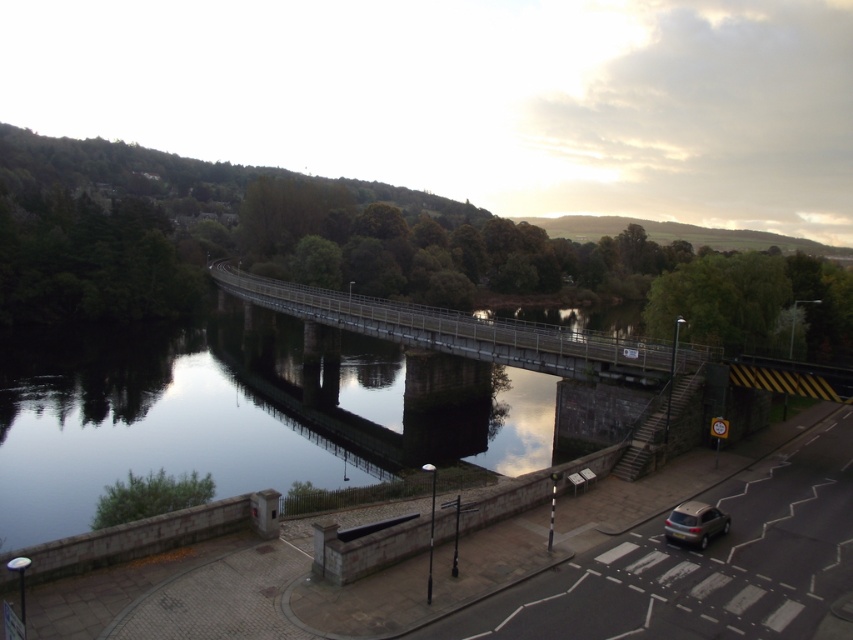
You are a delivery person who needs to park your vehicle near the reflective concrete water at center without blocking the pedestrian crossing. The satin silver car at lower right is already parked there. Can you park your vehicle next to it without overlapping the pedestrian crossing?

The reflective concrete water at center is wider than the satin silver car at lower right. Since the car is already parked there, you can park your vehicle next to it as long as the combined width of both vehicles does not exceed the available space on the road, ensuring that the pedestrian crossing remains unobstructed.

You are standing at the pedestrian crossing on the road and want to cross to the other side to reach the metallic gray bridge at center. According to the coordinates provided, is the bridge directly across from you or to one side?

The metallic gray bridge at center is located at coordinates point (457, 330), which indicates it is positioned centrally in the scene, so it should be directly across from you if you proceed straight across the pedestrian crossing.

You are a pedestrian standing on the sidewalk and want to cross the road to reach the riverbank. The black lamppost is your reference point. Which object, the reflective concrete water at center or the satin silver car at lower right, is closer to the lamppost?

The satin silver car at lower right is behind reflective concrete water at center, so the reflective concrete water at center is closer to the black lamppost.